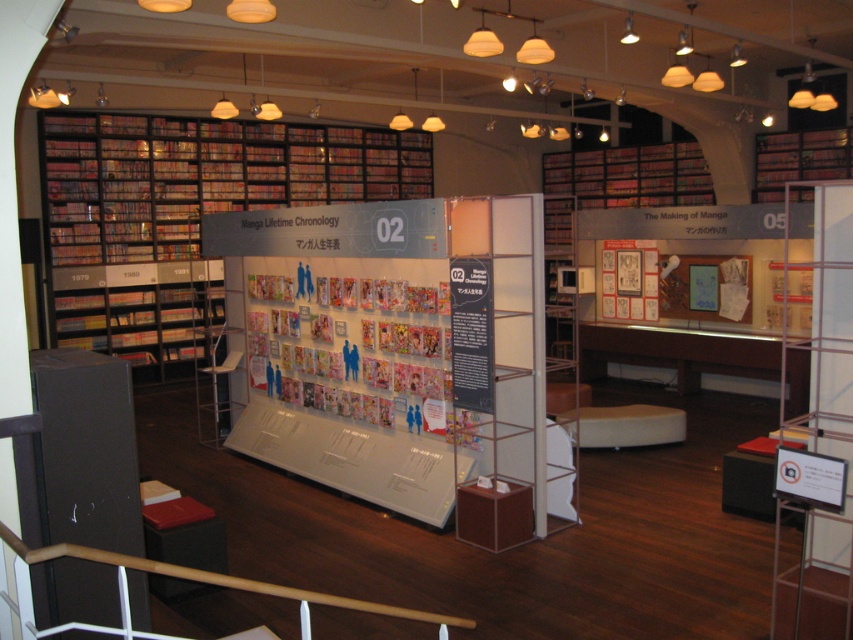
Is matte gray display at center taller than matte black bookshelf at left?

Yes.

Does point (309, 252) lie in front of point (413, 189)?

Yes, it is.

The width and height of the screenshot is (853, 640). What do you see at coordinates (384, 346) in the screenshot? I see `matte gray display at center` at bounding box center [384, 346].

I want to click on matte gray display at center, so click(384, 346).